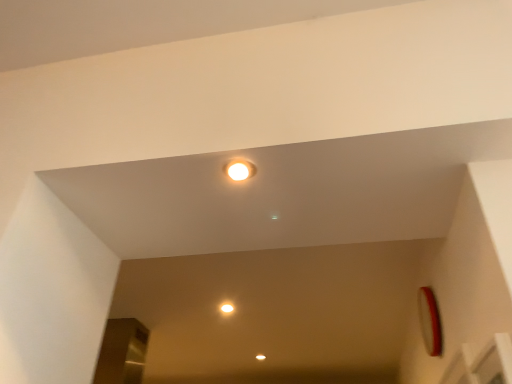
Question: Can you confirm if matte white light at center is thinner than white glossy light at center?

Choices:
 (A) yes
 (B) no

Answer: (A)

Question: Is matte white light at center closer to the viewer compared to white glossy light at center?

Choices:
 (A) no
 (B) yes

Answer: (A)

Question: Considering the relative sizes of matte white light at center and white glossy light at center in the image provided, is matte white light at center taller than white glossy light at center?

Choices:
 (A) yes
 (B) no

Answer: (A)

Question: Is matte white light at center smaller than white glossy light at center?

Choices:
 (A) no
 (B) yes

Answer: (A)

Question: Considering the relative sizes of matte white light at center and white glossy light at center in the image provided, is matte white light at center bigger than white glossy light at center?

Choices:
 (A) no
 (B) yes

Answer: (B)

Question: Is matte white light at center facing away from white glossy light at center?

Choices:
 (A) no
 (B) yes

Answer: (B)

Question: From the image's perspective, is white glossy light at center below matte white light at center?

Choices:
 (A) no
 (B) yes

Answer: (A)

Question: Is there a large distance between white glossy light at center and matte white light at center?

Choices:
 (A) yes
 (B) no

Answer: (A)

Question: Does white glossy light at center have a smaller size compared to matte white light at center?

Choices:
 (A) no
 (B) yes

Answer: (B)

Question: Can you see white glossy light at center touching matte white light at center?

Choices:
 (A) yes
 (B) no

Answer: (B)

Question: Does white glossy light at center have a larger size compared to matte white light at center?

Choices:
 (A) no
 (B) yes

Answer: (A)

Question: Can you confirm if white glossy light at center is shorter than matte white light at center?

Choices:
 (A) no
 (B) yes

Answer: (B)

Question: Considering their positions, is matte white light at center located in front of or behind white glossy light at center?

Choices:
 (A) behind
 (B) front

Answer: (A)